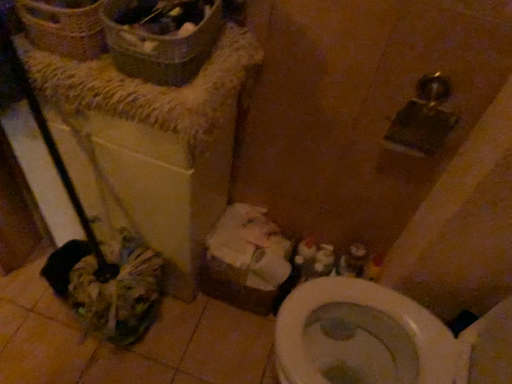
Where is `woven brown basket at upper left`? woven brown basket at upper left is located at coordinates (64, 27).

Describe the element at coordinates (64, 27) in the screenshot. I see `woven brown basket at upper left` at that location.

This screenshot has width=512, height=384. What do you see at coordinates (247, 261) in the screenshot? I see `white cardboard box at lower center` at bounding box center [247, 261].

Identify the location of white cardboard box at lower center. (247, 261).

What are the coordinates of `woven brown basket at upper left` in the screenshot? It's located at (64, 27).

Considering the relative positions of woven brown basket at upper left and white cardboard box at lower center in the image provided, is woven brown basket at upper left to the left of white cardboard box at lower center from the viewer's perspective?

Yes.

Is woven brown basket at upper left positioned behind white cardboard box at lower center?

No, woven brown basket at upper left is closer to the viewer.

Which is closer to the camera, (60, 41) or (259, 242)?

Point (60, 41).

From the image's perspective, between woven brown basket at upper left and white cardboard box at lower center, which one is located above?

woven brown basket at upper left.

From the picture: From a real-world perspective, which is physically below, woven brown basket at upper left or white cardboard box at lower center?

From a 3D spatial view, white cardboard box at lower center is below.

Which of these two, woven brown basket at upper left or white cardboard box at lower center, is wider?

With larger width is white cardboard box at lower center.

Which of these two, woven brown basket at upper left or white cardboard box at lower center, stands shorter?

Standing shorter between the two is woven brown basket at upper left.

Considering the sizes of objects woven brown basket at upper left and white cardboard box at lower center in the image provided, who is smaller, woven brown basket at upper left or white cardboard box at lower center?

woven brown basket at upper left is smaller.

Is white cardboard box at lower center completely or partially inside woven brown basket at upper left?

Definitely not — white cardboard box at lower center is not inside woven brown basket at upper left.

Is there a large distance between woven brown basket at upper left and white cardboard box at lower center?

That's not correct — woven brown basket at upper left is a little close to white cardboard box at lower center.

Is woven brown basket at upper left oriented towards white cardboard box at lower center?

No, woven brown basket at upper left is not aimed at white cardboard box at lower center.

How different are the orientations of woven brown basket at upper left and white cardboard box at lower center in degrees?

They differ by 5.24e-05 degrees in their facing directions.

How much distance is there between woven brown basket at upper left and white cardboard box at lower center?

The distance of woven brown basket at upper left from white cardboard box at lower center is 76.15 centimeters.

This screenshot has width=512, height=384. Identify the location of cardboard box that is on the right side of woven brown basket at upper left. (247, 261).

Considering the positions of objects white cardboard box at lower center and woven brown basket at upper left in the image provided, who is more to the left, white cardboard box at lower center or woven brown basket at upper left?

From the viewer's perspective, woven brown basket at upper left appears more on the left side.

Considering their positions, is white cardboard box at lower center located in front of or behind woven brown basket at upper left?

white cardboard box at lower center is positioned farther from the viewer than woven brown basket at upper left.

Which is less distant, (x=250, y=303) or (x=51, y=21)?

Point (x=51, y=21)

From the image's perspective, is white cardboard box at lower center beneath woven brown basket at upper left?

Correct, white cardboard box at lower center appears lower than woven brown basket at upper left in the image.

From a real-world perspective, is white cardboard box at lower center located beneath woven brown basket at upper left?

Indeed, from a real-world perspective, white cardboard box at lower center is positioned beneath woven brown basket at upper left.

Can you confirm if white cardboard box at lower center is thinner than woven brown basket at upper left?

No, white cardboard box at lower center is not thinner than woven brown basket at upper left.

Considering the sizes of white cardboard box at lower center and woven brown basket at upper left in the image, is white cardboard box at lower center taller or shorter than woven brown basket at upper left?

white cardboard box at lower center is taller than woven brown basket at upper left.

Considering the sizes of objects white cardboard box at lower center and woven brown basket at upper left in the image provided, who is bigger, white cardboard box at lower center or woven brown basket at upper left?

With larger size is white cardboard box at lower center.

Is white cardboard box at lower center surrounding woven brown basket at upper left?

No, woven brown basket at upper left is located outside of white cardboard box at lower center.

Are white cardboard box at lower center and woven brown basket at upper left far apart?

No, white cardboard box at lower center is in close proximity to woven brown basket at upper left.

Based on the photo, is white cardboard box at lower center oriented towards woven brown basket at upper left?

No, white cardboard box at lower center does not turn towards woven brown basket at upper left.

Identify the location of cardboard box behind the woven brown basket at upper left. The width and height of the screenshot is (512, 384). (247, 261).

Where is `basket on the left of white cardboard box at lower center`? The height and width of the screenshot is (384, 512). basket on the left of white cardboard box at lower center is located at coordinates (64, 27).

Identify the location of basket above the white cardboard box at lower center (from the image's perspective). The height and width of the screenshot is (384, 512). (64, 27).